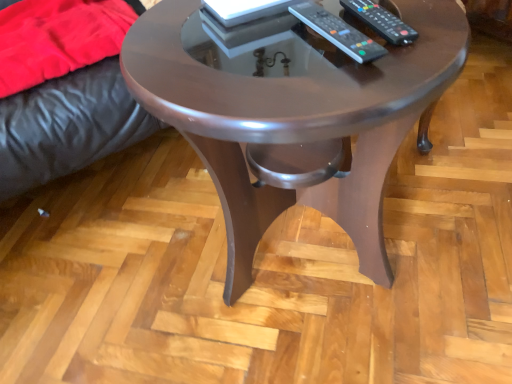
Locate an element on the screen. vacant space to the right of shiny brown wood coffee table at center is located at coordinates (455, 197).